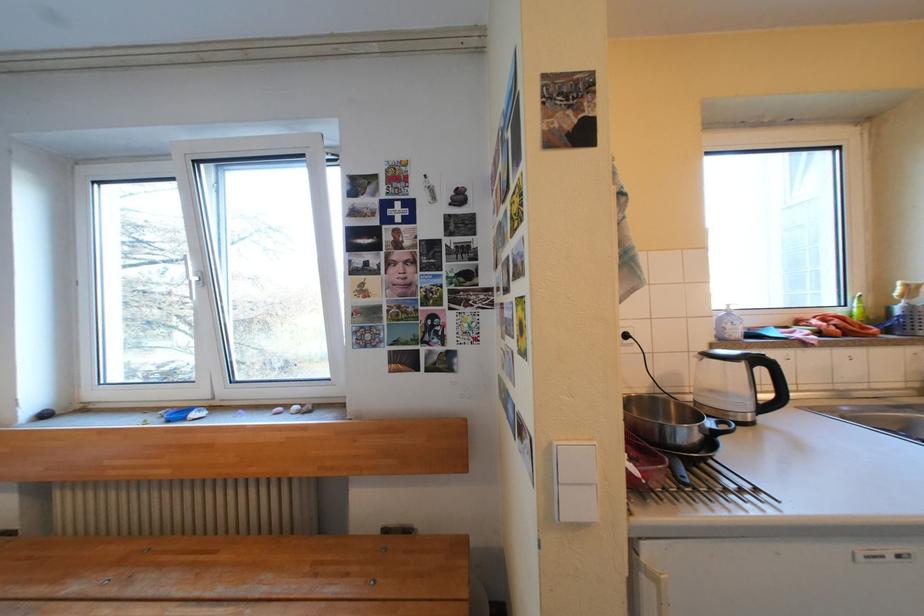
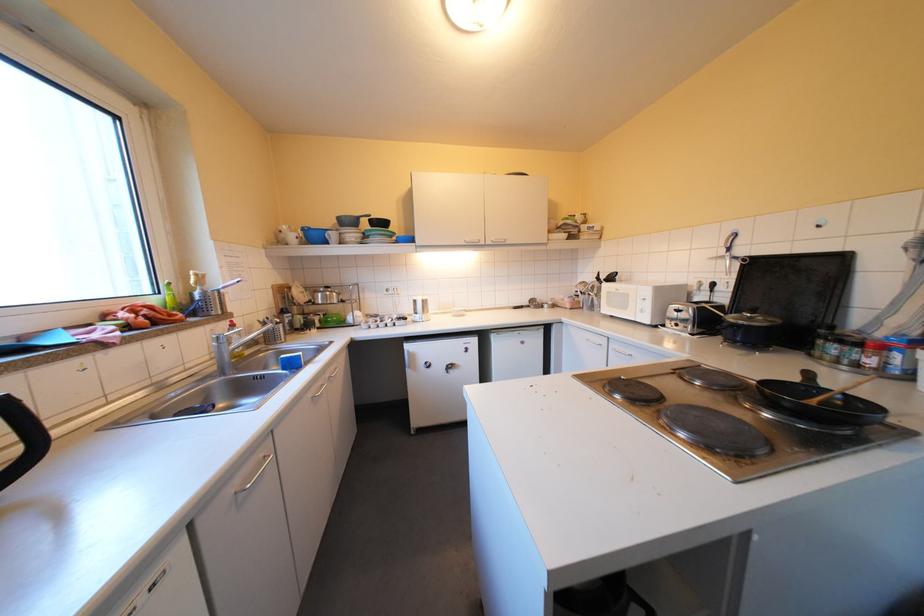
The point at (x=776, y=408) is marked in the first image. Where is the corresponding point in the second image?

(17, 479)